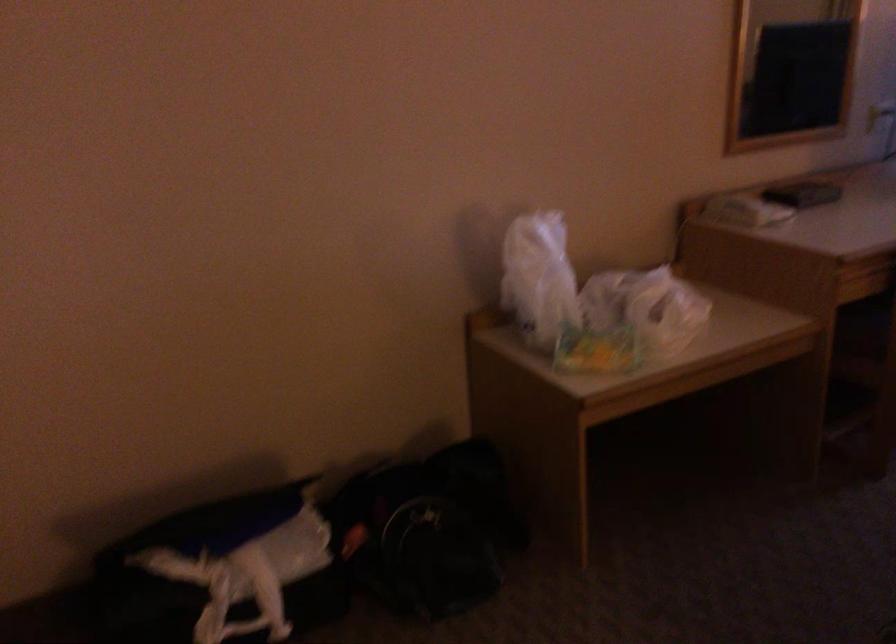
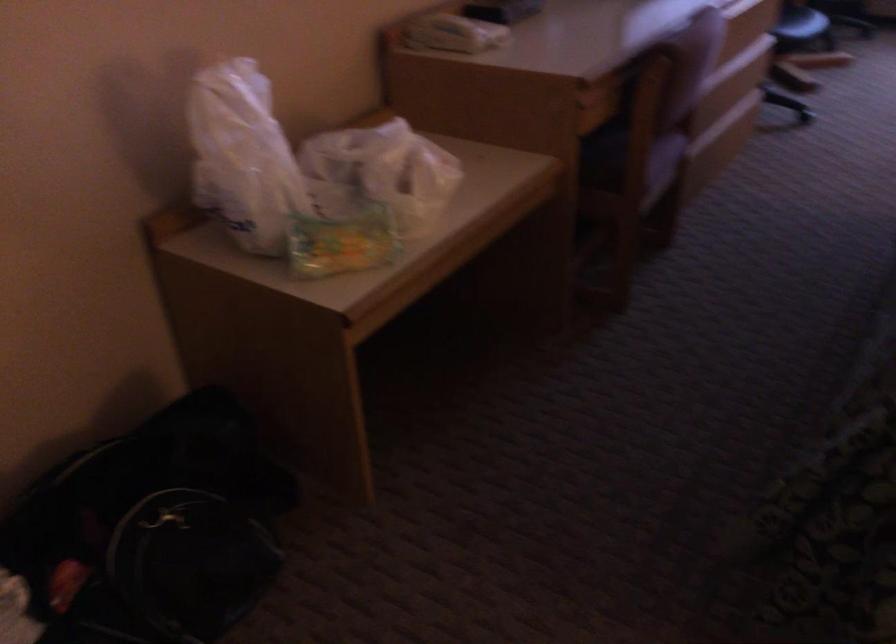
Question: The camera is either moving clockwise (left) or counter-clockwise (right) around the object. The first image is from the beginning of the video and the second image is from the end. Is the camera moving left or right when shooting the video?

Choices:
 (A) Left
 (B) Right

Answer: (A)